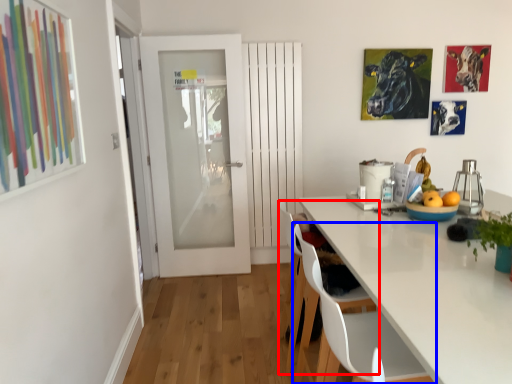
Question: Which object is further to the camera taking this photo, chair (highlighted by a red box) or chair (highlighted by a blue box)?

Choices:
 (A) chair
 (B) chair

Answer: (A)